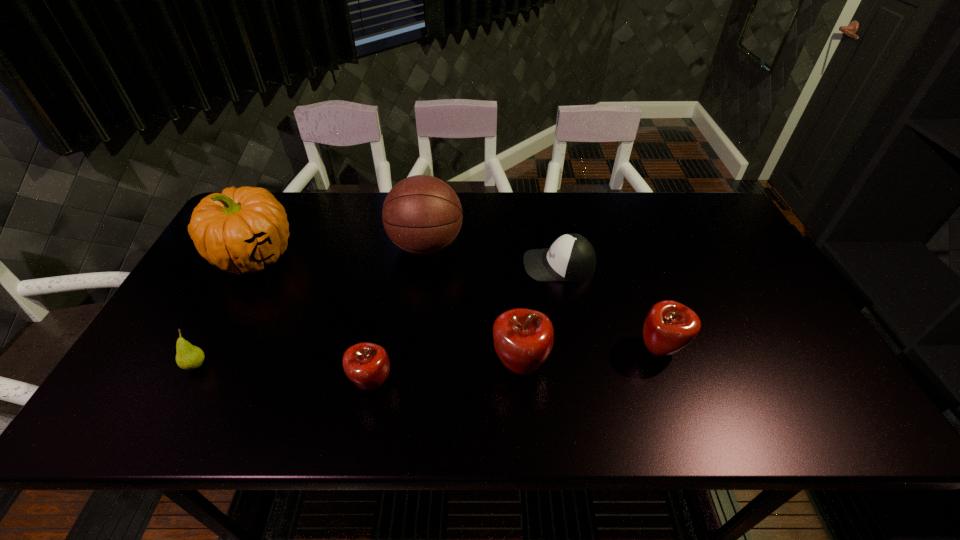
Locate an element on the screen. The width and height of the screenshot is (960, 540). the shortest apple is located at coordinates (366, 364).

Locate an element on the screen. The image size is (960, 540). the second apple from left to right is located at coordinates (523, 338).

You are a GUI agent. You are given a task and a screenshot of the screen. Output one action in this format:
    pyautogui.click(x=<x>, y=<y>)
    Task: Click on the rightmost object
    
    Given the screenshot: What is the action you would take?
    pyautogui.click(x=669, y=327)

At what (x,y) coordinates should I click in order to perform the action: click on the rightmost apple. Please return your answer as a coordinate pair (x, y). Looking at the image, I should click on pyautogui.click(x=669, y=327).

In order to click on pumpkin in this screenshot , I will do `click(240, 231)`.

This screenshot has height=540, width=960. Identify the location of cap. pos(571,257).

At what (x,y) coordinates should I click in order to perform the action: click on basketball. Please return your answer as a coordinate pair (x, y). Image resolution: width=960 pixels, height=540 pixels. Looking at the image, I should click on (422, 215).

Where is `pear`? pear is located at coordinates (188, 357).

Where is `free location located 0.300m on the back of the shortest apple`? free location located 0.300m on the back of the shortest apple is located at coordinates (394, 276).

The width and height of the screenshot is (960, 540). Identify the location of free space located on the right of the second apple from right to left. (656, 366).